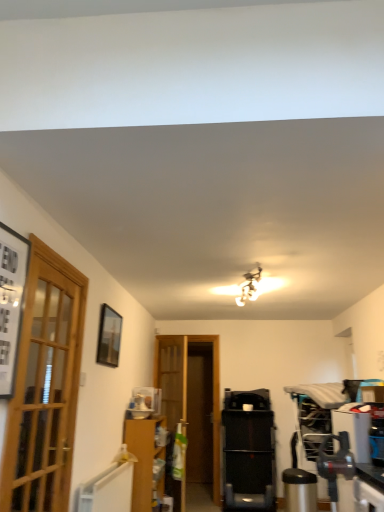
Question: From the image's perspective, does black plastic treadmill at center appear lower than matte black picture frame at upper left, which appears as the 1th picture frame when viewed from the right?

Choices:
 (A) yes
 (B) no

Answer: (A)

Question: From a real-world perspective, is black plastic treadmill at center beneath matte black picture frame at upper left, which appears as the 1th picture frame when viewed from the right?

Choices:
 (A) no
 (B) yes

Answer: (B)

Question: Can you confirm if black plastic treadmill at center is shorter than matte black picture frame at upper left, which is counted as the second picture frame, starting from the front?

Choices:
 (A) no
 (B) yes

Answer: (A)

Question: Is black plastic treadmill at center wider than matte black picture frame at upper left, which is the 2th picture frame in left-to-right order?

Choices:
 (A) no
 (B) yes

Answer: (B)

Question: Does black plastic treadmill at center have a smaller size compared to matte black picture frame at upper left, which is counted as the second picture frame, starting from the front?

Choices:
 (A) yes
 (B) no

Answer: (B)

Question: Considering the positions of point (117, 357) and point (273, 422), is point (117, 357) closer or farther from the camera than point (273, 422)?

Choices:
 (A) closer
 (B) farther

Answer: (A)

Question: Is matte black picture frame at upper left, placed as the first picture frame when sorted from back to front, wider or thinner than black plastic treadmill at center?

Choices:
 (A) thin
 (B) wide

Answer: (A)

Question: Based on their positions, is matte black picture frame at upper left, which is counted as the second picture frame, starting from the front, located to the left or right of black plastic treadmill at center?

Choices:
 (A) right
 (B) left

Answer: (B)

Question: From their relative heights in the image, would you say matte black picture frame at upper left, placed as the first picture frame when sorted from back to front, is taller or shorter than black plastic treadmill at center?

Choices:
 (A) tall
 (B) short

Answer: (B)

Question: From the image's perspective, is black plastic treadmill at center positioned above or below matte black picture frame at upper left, which appears as the 1th picture frame when viewed from the right?

Choices:
 (A) below
 (B) above

Answer: (A)

Question: Is black plastic treadmill at center taller or shorter than matte black picture frame at upper left, placed as the first picture frame when sorted from back to front?

Choices:
 (A) tall
 (B) short

Answer: (A)

Question: Is point pyautogui.click(x=236, y=489) closer or farther from the camera than point pyautogui.click(x=112, y=338)?

Choices:
 (A) farther
 (B) closer

Answer: (A)

Question: Is black plastic treadmill at center spatially inside matte black picture frame at upper left, which appears as the 1th picture frame when viewed from the right, or outside of it?

Choices:
 (A) inside
 (B) outside

Answer: (B)

Question: Choose the correct answer: Is black plastic treadmill at center inside black matte picture frame at left, which is the second picture frame from back to front, or outside it?

Choices:
 (A) outside
 (B) inside

Answer: (A)

Question: Is black plastic treadmill at center in front of or behind black matte picture frame at left, which is the second picture frame from back to front, in the image?

Choices:
 (A) front
 (B) behind

Answer: (B)